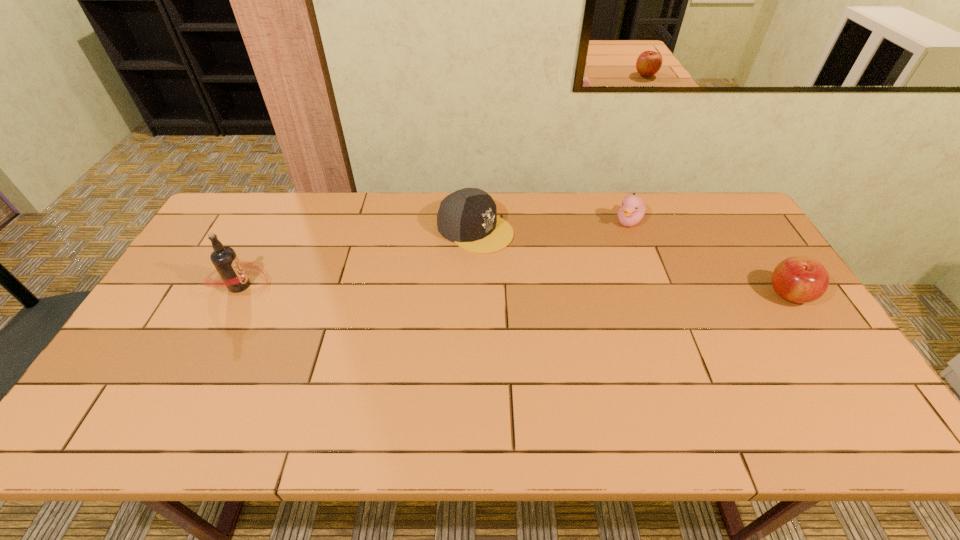
Where is `vacant space located 0.150m on the front-facing side of the third object from left to right`? vacant space located 0.150m on the front-facing side of the third object from left to right is located at coordinates (609, 258).

In order to click on vacant area situated on the front-facing side of the third object from left to right in this screenshot , I will do `click(585, 299)`.

Locate an element on the screen. vacant point located on the front-facing side of the cap is located at coordinates (564, 275).

The width and height of the screenshot is (960, 540). I want to click on blank area located on the front-facing side of the cap, so click(579, 283).

Where is `free point located 0.110m on the front-facing side of the cap`? free point located 0.110m on the front-facing side of the cap is located at coordinates (534, 259).

The width and height of the screenshot is (960, 540). I want to click on duckling that is at the far edge, so coord(633,208).

Identify the location of cap that is at the far edge. The height and width of the screenshot is (540, 960). (468, 217).

Locate an element on the screen. Image resolution: width=960 pixels, height=540 pixels. object at the left edge is located at coordinates (230, 268).

At what (x,y) coordinates should I click in order to perform the action: click on object positioned at the right edge. Please return your answer as a coordinate pair (x, y). Looking at the image, I should click on (798, 279).

In order to click on free region at the far edge in this screenshot , I will do `click(652, 204)`.